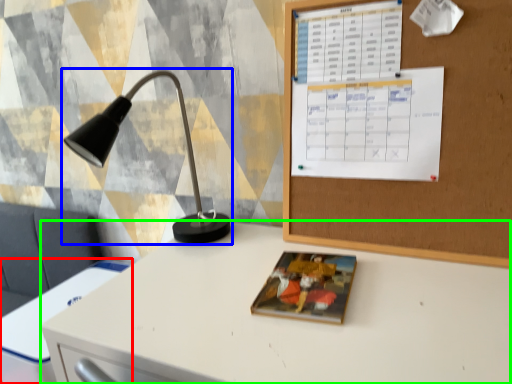
Question: Considering the real-world distances, which object is closest to computer desk (highlighted by a red box)? lamp (highlighted by a blue box) or desk (highlighted by a green box).

Choices:
 (A) lamp
 (B) desk

Answer: (B)